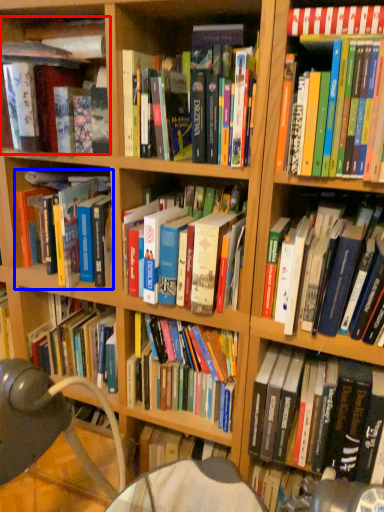
Question: Among these objects, which one is nearest to the camera, book (highlighted by a red box) or book (highlighted by a blue box)?

Choices:
 (A) book
 (B) book

Answer: (A)